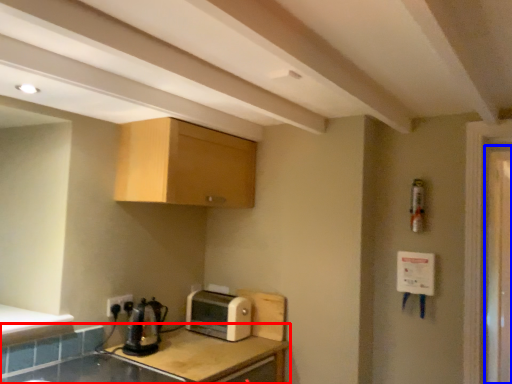
Question: Which of the following is the closest to the observer, countertop (highlighted by a red box) or screen door (highlighted by a blue box)?

Choices:
 (A) countertop
 (B) screen door

Answer: (A)